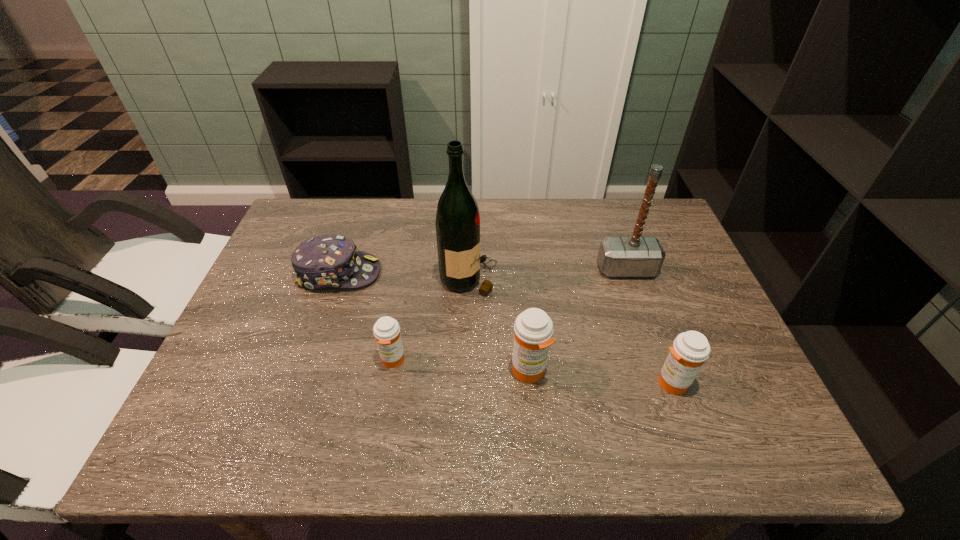
At what (x,y) coordinates should I click in order to perform the action: click on the fifth object from right to left. Please return your answer as a coordinate pair (x, y). This screenshot has width=960, height=540. Looking at the image, I should click on (386, 330).

In order to click on the second shortest object in this screenshot , I will do `click(386, 330)`.

Where is `the third object from right to left`? the third object from right to left is located at coordinates (533, 329).

Locate an element on the screen. the rightmost medicine is located at coordinates (690, 349).

Identify the location of the second tallest medicine. Image resolution: width=960 pixels, height=540 pixels. (690, 349).

Locate an element on the screen. Image resolution: width=960 pixels, height=540 pixels. the leftmost object is located at coordinates (328, 261).

Identify the location of headwear. (328, 261).

Where is `wine bottle`? The image size is (960, 540). wine bottle is located at coordinates (457, 223).

I want to click on the tallest object, so click(x=457, y=223).

Locate an element on the screen. hammer is located at coordinates (636, 256).